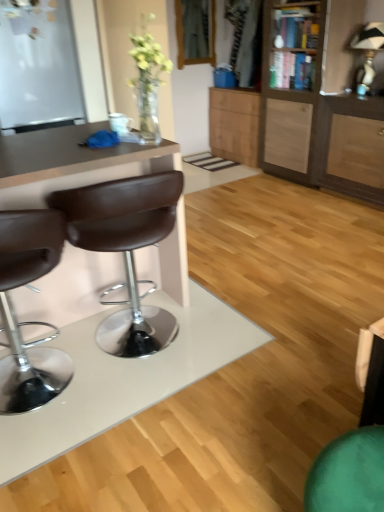
Question: Is brown leather stool at left, which appears as the 2th chair when viewed from the left, oriented towards white matte glass door at upper left?

Choices:
 (A) no
 (B) yes

Answer: (B)

Question: Is brown leather stool at left, which appears as the 2th chair when viewed from the left, located outside white matte glass door at upper left?

Choices:
 (A) yes
 (B) no

Answer: (A)

Question: Is brown leather stool at left, which appears as the 2th chair when viewed from the left, closer to camera compared to white matte glass door at upper left?

Choices:
 (A) no
 (B) yes

Answer: (B)

Question: Considering the relative sizes of brown leather stool at left, which appears as the 2th chair when viewed from the left, and white matte glass door at upper left in the image provided, is brown leather stool at left, which appears as the 2th chair when viewed from the left, smaller than white matte glass door at upper left?

Choices:
 (A) no
 (B) yes

Answer: (B)

Question: From a real-world perspective, is brown leather stool at left, arranged as the 1th chair when viewed from the right, physically below white matte glass door at upper left?

Choices:
 (A) no
 (B) yes

Answer: (B)

Question: Does brown leather stool at left, which appears as the 2th chair when viewed from the left, appear on the left side of white matte glass door at upper left?

Choices:
 (A) no
 (B) yes

Answer: (A)

Question: Considering the relative sizes of wooden cabinet at right, the 2th cabinetry positioned from the back, and brown leather stool at left, placed as the 2th chair when sorted from right to left, in the image provided, is wooden cabinet at right, the 2th cabinetry positioned from the back, smaller than brown leather stool at left, placed as the 2th chair when sorted from right to left,?

Choices:
 (A) yes
 (B) no

Answer: (B)

Question: Is wooden cabinet at right, placed as the first cabinetry when sorted from front to back, positioned beyond the bounds of brown leather stool at left, the 1th chair positioned from the left?

Choices:
 (A) yes
 (B) no

Answer: (A)

Question: Is wooden cabinet at right, the 2th cabinetry positioned from the back, positioned with its back to brown leather stool at left, placed as the 2th chair when sorted from right to left?

Choices:
 (A) no
 (B) yes

Answer: (A)

Question: From a real-world perspective, does wooden cabinet at right, the 2th cabinetry positioned from the back, sit lower than brown leather stool at left, placed as the 2th chair when sorted from right to left?

Choices:
 (A) yes
 (B) no

Answer: (B)

Question: Is wooden cabinet at right, placed as the first cabinetry when sorted from front to back, not close to brown leather stool at left, placed as the 2th chair when sorted from right to left?

Choices:
 (A) yes
 (B) no

Answer: (A)

Question: Is wooden cabinet at right, the 2th cabinetry positioned from the back, to the left of brown leather stool at left, placed as the 2th chair when sorted from right to left, from the viewer's perspective?

Choices:
 (A) yes
 (B) no

Answer: (B)

Question: Would you say brown leather stool at left, the 1th chair positioned from the left, is part of brown leather desk at left's contents?

Choices:
 (A) no
 (B) yes

Answer: (B)